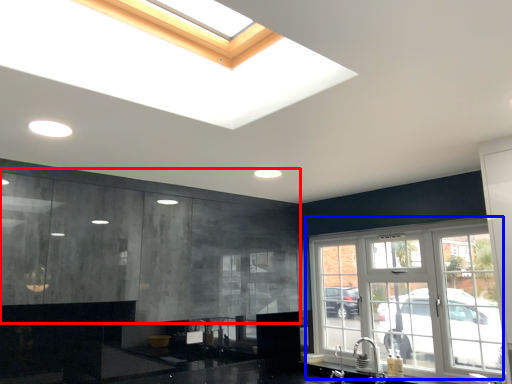
Question: Which object appears closest to the camera in this image, cabinetry (highlighted by a red box) or window (highlighted by a blue box)?

Choices:
 (A) cabinetry
 (B) window

Answer: (A)